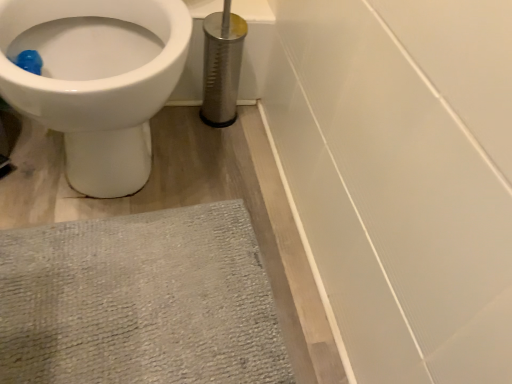
What is the approximate height of gray textured bath mat at lower left?

The height of gray textured bath mat at lower left is 1.84 inches.

What do you see at coordinates (140, 301) in the screenshot? This screenshot has height=384, width=512. I see `gray textured bath mat at lower left` at bounding box center [140, 301].

This screenshot has width=512, height=384. Find the location of `gray textured bath mat at lower left`. gray textured bath mat at lower left is located at coordinates (140, 301).

What is the approximate width of white glossy toilet at upper left?

The width of white glossy toilet at upper left is 26.28 inches.

Find the location of a particular element. This screenshot has height=384, width=512. white glossy toilet at upper left is located at coordinates (96, 80).

The image size is (512, 384). Describe the element at coordinates (96, 80) in the screenshot. I see `white glossy toilet at upper left` at that location.

This screenshot has height=384, width=512. I want to click on gray textured bath mat at lower left, so click(x=140, y=301).

Considering the relative positions of white glossy toilet at upper left and gray textured bath mat at lower left in the image provided, is white glossy toilet at upper left to the left or to the right of gray textured bath mat at lower left?

white glossy toilet at upper left is positioned on gray textured bath mat at lower left's left side.

Is white glossy toilet at upper left behind gray textured bath mat at lower left?

No, white glossy toilet at upper left is closer to the viewer.

Based on the photo, which is closer, (x=28, y=21) or (x=268, y=330)?

The point (x=268, y=330) is closer to the camera.

From the image's perspective, which is above, white glossy toilet at upper left or gray textured bath mat at lower left?

white glossy toilet at upper left.

From a real-world perspective, which object stands above the other?

In real-world perspective, white glossy toilet at upper left is above.

Is white glossy toilet at upper left wider than gray textured bath mat at lower left?

Yes.

Considering the relative sizes of white glossy toilet at upper left and gray textured bath mat at lower left in the image provided, is white glossy toilet at upper left taller than gray textured bath mat at lower left?

Yes, white glossy toilet at upper left is taller than gray textured bath mat at lower left.

Considering the relative sizes of white glossy toilet at upper left and gray textured bath mat at lower left in the image provided, is white glossy toilet at upper left smaller than gray textured bath mat at lower left?

No.

Which is correct: white glossy toilet at upper left is inside gray textured bath mat at lower left, or outside of it?

white glossy toilet at upper left is located beyond the bounds of gray textured bath mat at lower left.

Are white glossy toilet at upper left and gray textured bath mat at lower left making contact?

white glossy toilet at upper left and gray textured bath mat at lower left are clearly separated.

In the scene shown: Is white glossy toilet at upper left aimed at gray textured bath mat at lower left?

Yes, white glossy toilet at upper left is aimed at gray textured bath mat at lower left.

How many degrees apart are the facing directions of white glossy toilet at upper left and gray textured bath mat at lower left?

The angular difference between white glossy toilet at upper left and gray textured bath mat at lower left is 0.00119 degrees.

Locate an element on the screen. The height and width of the screenshot is (384, 512). bath mat below the white glossy toilet at upper left (from the image's perspective) is located at coordinates (140, 301).

Does gray textured bath mat at lower left appear on the left side of white glossy toilet at upper left?

Incorrect, gray textured bath mat at lower left is not on the left side of white glossy toilet at upper left.

Is the depth of gray textured bath mat at lower left less than that of white glossy toilet at upper left?

No, gray textured bath mat at lower left is further to the viewer.

Which is closer to the camera, (26, 265) or (97, 107)?

Point (26, 265) is positioned farther from the camera compared to point (97, 107).

From the image's perspective, does gray textured bath mat at lower left appear higher than white glossy toilet at upper left?

No.

From a real-world perspective, is gray textured bath mat at lower left physically located above or below white glossy toilet at upper left?

In terms of real-world spatial position, gray textured bath mat at lower left is below white glossy toilet at upper left.

Between gray textured bath mat at lower left and white glossy toilet at upper left, which one has smaller width?

gray textured bath mat at lower left.

Considering the relative sizes of gray textured bath mat at lower left and white glossy toilet at upper left in the image provided, is gray textured bath mat at lower left shorter than white glossy toilet at upper left?

Yes, gray textured bath mat at lower left is shorter than white glossy toilet at upper left.

Is gray textured bath mat at lower left smaller than white glossy toilet at upper left?

Indeed, gray textured bath mat at lower left has a smaller size compared to white glossy toilet at upper left.

Looking at this image, is gray textured bath mat at lower left completely or partially outside of white glossy toilet at upper left?

Yes, gray textured bath mat at lower left is not within white glossy toilet at upper left.

Is gray textured bath mat at lower left positioned far away from white glossy toilet at upper left?

gray textured bath mat at lower left is actually quite close to white glossy toilet at upper left.

Is gray textured bath mat at lower left positioned with its back to white glossy toilet at upper left?

Yes, gray textured bath mat at lower left's orientation is away from white glossy toilet at upper left.

Measure the distance from gray textured bath mat at lower left to white glossy toilet at upper left.

gray textured bath mat at lower left is 11.49 inches from white glossy toilet at upper left.

The width and height of the screenshot is (512, 384). I want to click on bath mat below the white glossy toilet at upper left (from the image's perspective), so click(x=140, y=301).

Locate an element on the screen. bath mat located below the white glossy toilet at upper left (from the image's perspective) is located at coordinates (140, 301).

Locate an element on the screen. The height and width of the screenshot is (384, 512). toilet that is above the gray textured bath mat at lower left (from a real-world perspective) is located at coordinates (96, 80).